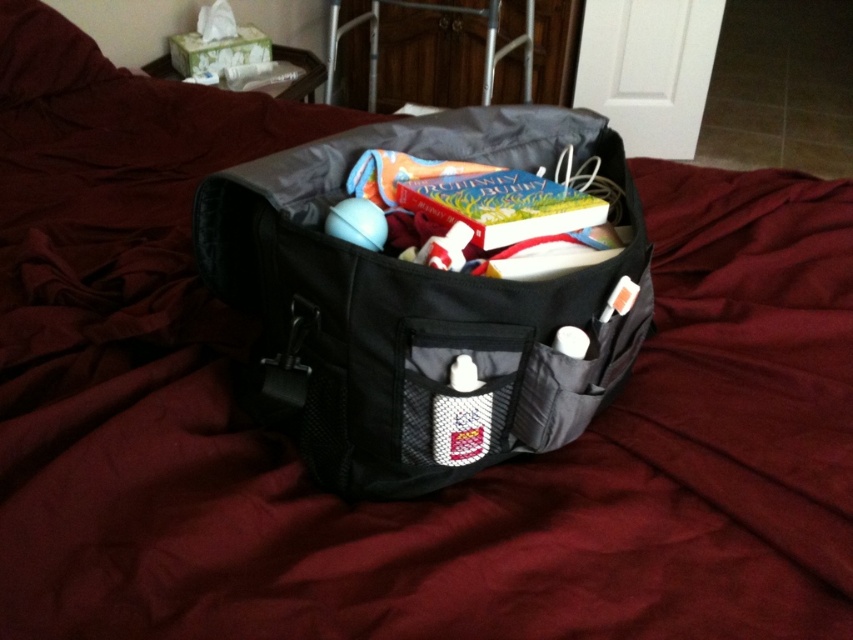
Who is lower down, black fabric bag at center or white mesh pocket at center?

white mesh pocket at center is lower down.

Describe the element at coordinates (415, 307) in the screenshot. I see `black fabric bag at center` at that location.

Where is `black fabric bag at center`? black fabric bag at center is located at coordinates (415, 307).